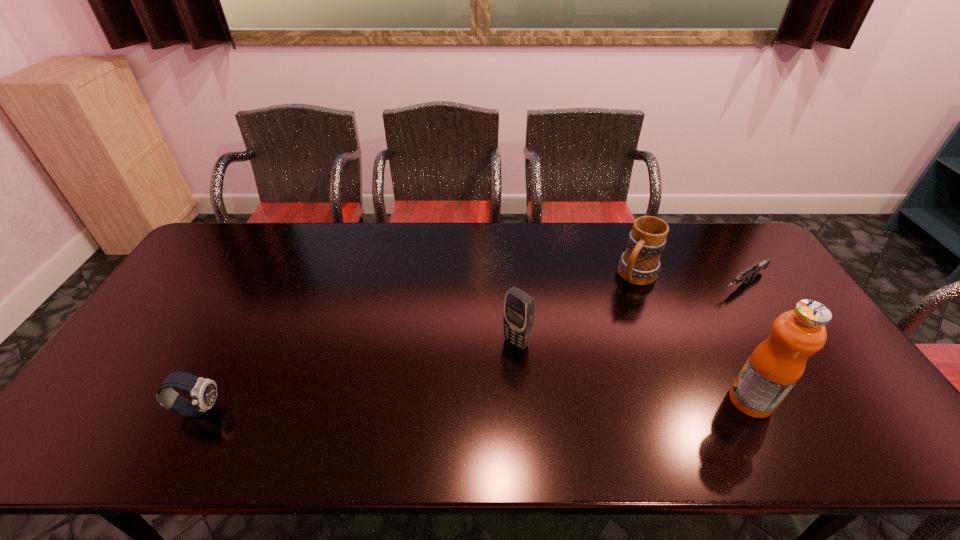
Image resolution: width=960 pixels, height=540 pixels. Identify the location of the closest object to the third nearest object. (640, 264).

Point out which object is positioned as the second nearest to the fourth object from right to left. Please provide its 2D coordinates. Your answer should be formatted as a tuple, i.e. [(x, y)], where the tuple contains the x and y coordinates of a point satisfying the conditions above.

[(774, 367)]

The width and height of the screenshot is (960, 540). I want to click on vacant space that satisfies the following two spatial constraints: 1. on the back side of the cellular telephone; 2. on the left side of the third object from right to left, so click(512, 276).